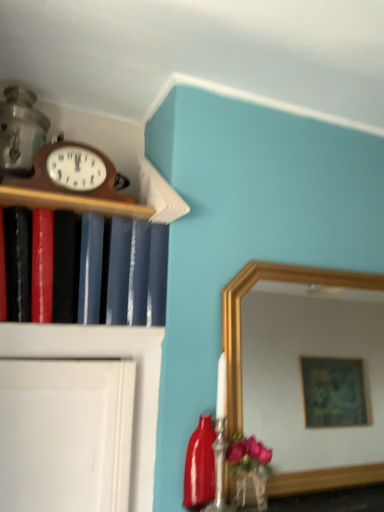
Question: From a real-world perspective, is glossy ceramic bottle at lower right physically below woodenmaterial/texture wall clock at upper left?

Choices:
 (A) yes
 (B) no

Answer: (A)

Question: Can you confirm if glossy ceramic bottle at lower right is shorter than woodenmaterial/texture wall clock at upper left?

Choices:
 (A) yes
 (B) no

Answer: (B)

Question: Is glossy ceramic bottle at lower right facing away from woodenmaterial/texture wall clock at upper left?

Choices:
 (A) no
 (B) yes

Answer: (A)

Question: From the image's perspective, is glossy ceramic bottle at lower right beneath woodenmaterial/texture wall clock at upper left?

Choices:
 (A) yes
 (B) no

Answer: (A)

Question: Is glossy ceramic bottle at lower right facing towards woodenmaterial/texture wall clock at upper left?

Choices:
 (A) no
 (B) yes

Answer: (A)

Question: Based on their positions, is matte black book at left located to the left or right of woodenmaterial/texture wall clock at upper left?

Choices:
 (A) left
 (B) right

Answer: (A)

Question: From the image's perspective, is matte black book at left located above or below woodenmaterial/texture wall clock at upper left?

Choices:
 (A) below
 (B) above

Answer: (A)

Question: Considering the positions of matte black book at left and woodenmaterial/texture wall clock at upper left in the image, is matte black book at left bigger or smaller than woodenmaterial/texture wall clock at upper left?

Choices:
 (A) big
 (B) small

Answer: (A)

Question: From their relative heights in the image, would you say matte black book at left is taller or shorter than woodenmaterial/texture wall clock at upper left?

Choices:
 (A) tall
 (B) short

Answer: (A)

Question: Visually, is glossy ceramic bottle at lower right positioned to the left or to the right of woodenmaterial/texture wall clock at upper left?

Choices:
 (A) right
 (B) left

Answer: (A)

Question: Is point (195, 451) closer or farther from the camera than point (109, 176)?

Choices:
 (A) farther
 (B) closer

Answer: (B)

Question: Is glossy ceramic bottle at lower right taller or shorter than woodenmaterial/texture wall clock at upper left?

Choices:
 (A) tall
 (B) short

Answer: (A)

Question: From a real-world perspective, is glossy ceramic bottle at lower right physically located above or below woodenmaterial/texture wall clock at upper left?

Choices:
 (A) below
 (B) above

Answer: (A)

Question: From a real-world perspective, is glossy ceramic bottle at lower right positioned above or below matte black book at left?

Choices:
 (A) above
 (B) below

Answer: (B)

Question: Is glossy ceramic bottle at lower right wider or thinner than matte black book at left?

Choices:
 (A) wide
 (B) thin

Answer: (B)